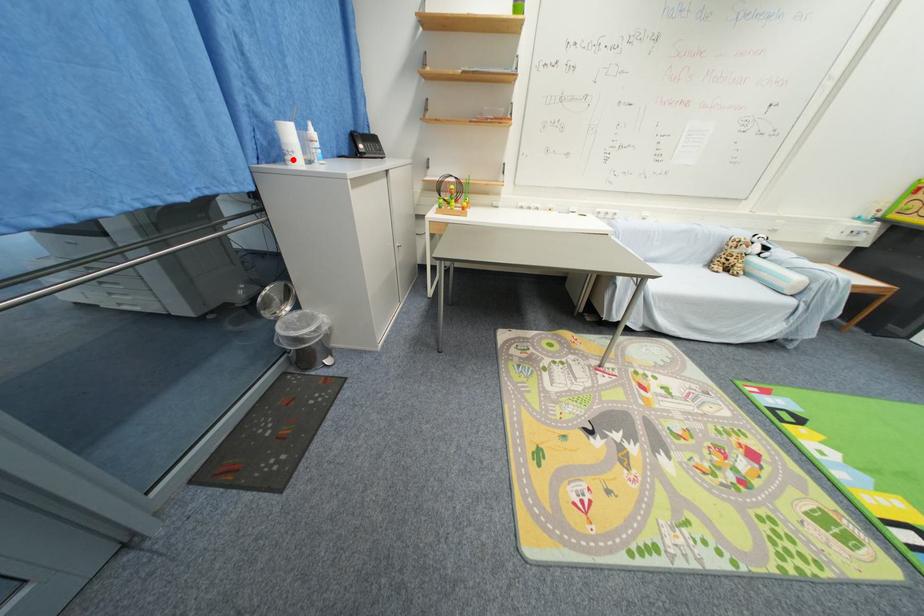
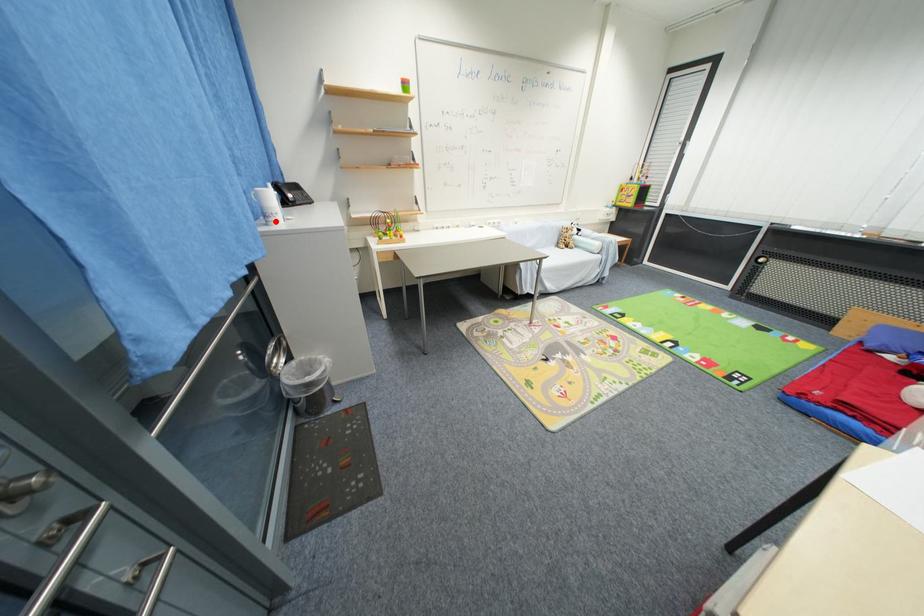
I am providing you with two images of the same scene from different viewpoints. A red point is marked on the first image and another point is marked on the second image. Does the point marked in image1 correspond to the same location as the one in image2?

Yes